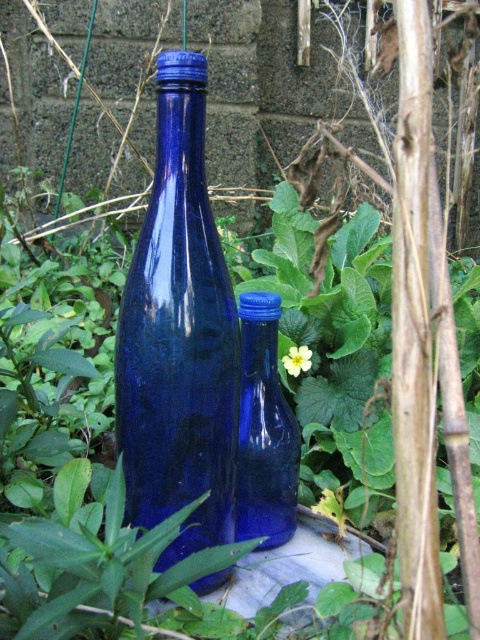
Please provide the exact coordinates of the cobalt blue glass bottle at center in the image. The coordinate system has its origin at the bottom left corner of the image, with the x and y axes increasing to the right and upwards respectively.

The cobalt blue glass bottle at center is located at coordinates point [178,336].

You are a gardener who wants to place a new small decorative item between the blue glass bottle at center and the yellow matte flower at center. Which object should you place it closer to if you want the item to be closer to the smaller object?

The yellow matte flower at center is smaller than the blue glass bottle at center, so placing the new item closer to the yellow matte flower at center would position it near the smaller object.

You are a gardener who wants to place a new plant between the cobalt blue glass bottle at center and the yellow matte flower at center. The plant requires a minimum of 30 centimeters of space to grow properly. Based on the image, will there be enough space between them for the plant?

The cobalt blue glass bottle at center and yellow matte flower at center are 28.46 centimeters apart from each other. Since the required space is 30 centimeters, there is insufficient space for the plant to grow properly.